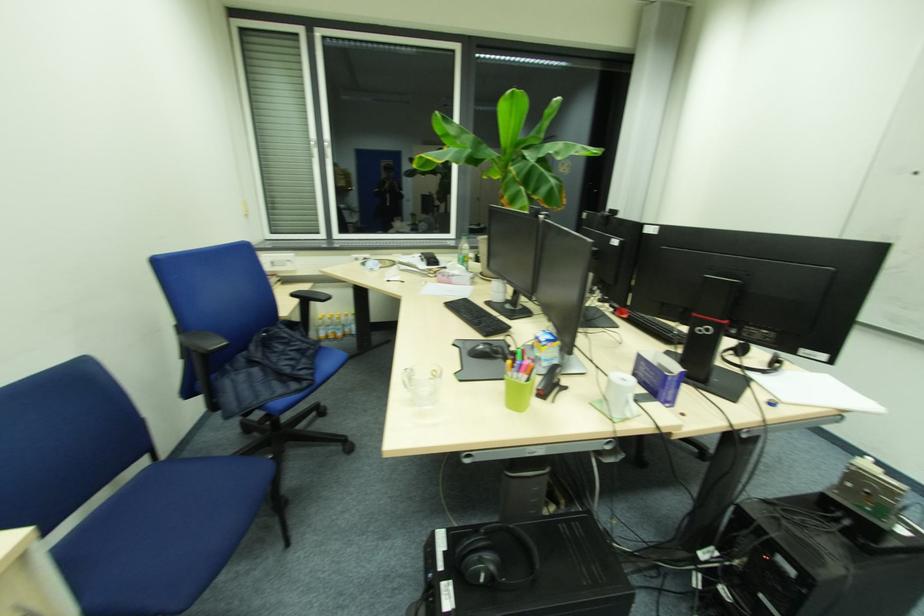
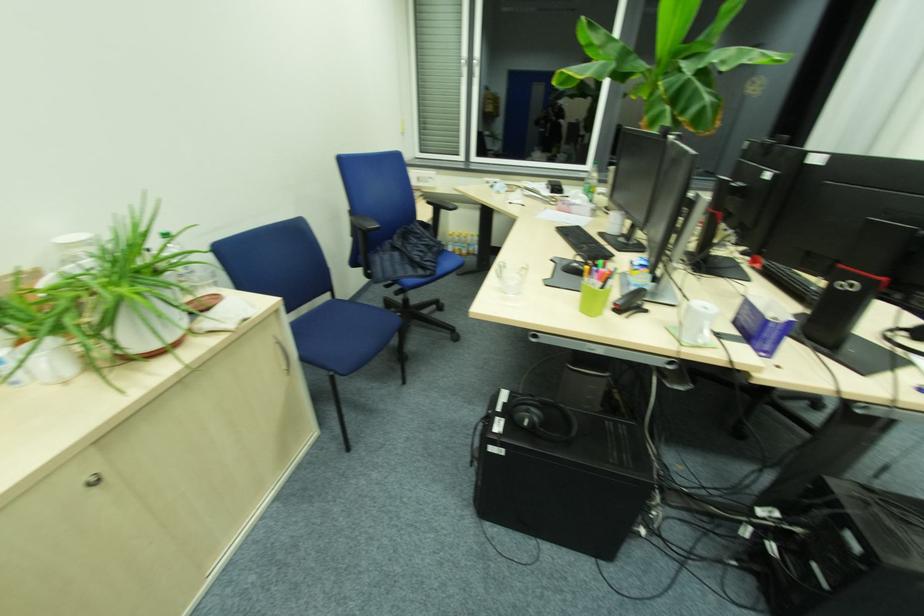
Find the pixel in the second image that matches [451,549] in the first image.

(511, 403)